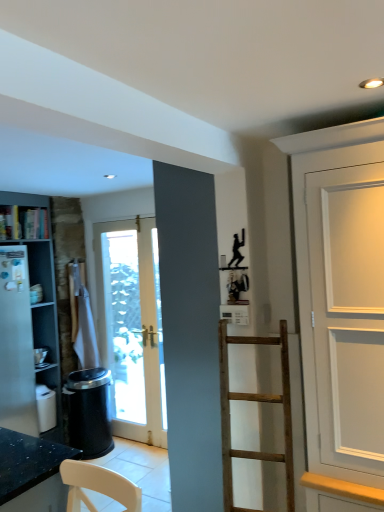
Image resolution: width=384 pixels, height=512 pixels. I want to click on wooden bookshelf at left, so click(x=27, y=215).

This screenshot has height=512, width=384. What do you see at coordinates (27, 215) in the screenshot?
I see `wooden bookshelf at left` at bounding box center [27, 215].

Based on the photo, what is the approximate width of wooden bookshelf at left?

8.91 inches.

This screenshot has height=512, width=384. What do you see at coordinates (41, 303) in the screenshot?
I see `white matte cabinet at left` at bounding box center [41, 303].

Where is `white matte cabinet at left`? white matte cabinet at left is located at coordinates (41, 303).

The image size is (384, 512). Find the location of `wooden bookshelf at left`. wooden bookshelf at left is located at coordinates (27, 215).

Does white matte cabinet at left appear on the right side of wooden bookshelf at left?

In fact, white matte cabinet at left is to the left of wooden bookshelf at left.

Does white matte cabinet at left come in front of wooden bookshelf at left?

Yes, white matte cabinet at left is closer to the camera.

Is point (56, 333) more distant than point (8, 232)?

Yes, point (56, 333) is behind point (8, 232).

From the image's perspective, between white matte cabinet at left and wooden bookshelf at left, who is located below?

From the image's view, white matte cabinet at left is below.

In the scene shown: From a real-world perspective, is white matte cabinet at left positioned above or below wooden bookshelf at left?

white matte cabinet at left is below wooden bookshelf at left.

Which of these two, white matte cabinet at left or wooden bookshelf at left, is wider?

With larger width is white matte cabinet at left.

Is white matte cabinet at left taller than wooden bookshelf at left?

Yes.

Can you confirm if white matte cabinet at left is smaller than wooden bookshelf at left?

No, white matte cabinet at left is not smaller than wooden bookshelf at left.

Which is correct: white matte cabinet at left is inside wooden bookshelf at left, or outside of it?

white matte cabinet at left is not inside wooden bookshelf at left, it's outside.

Is white matte cabinet at left touching wooden bookshelf at left?

No, white matte cabinet at left is not next to wooden bookshelf at left.

Is white matte cabinet at left facing towards wooden bookshelf at left?

Yes, white matte cabinet at left is turned towards wooden bookshelf at left.

What's the angular difference between white matte cabinet at left and wooden bookshelf at left's facing directions?

The facing directions of white matte cabinet at left and wooden bookshelf at left are 1.33 degrees apart.

Identify the location of cabinetry below the wooden bookshelf at left (from a real-world perspective). The image size is (384, 512). (41, 303).

Considering the positions of objects wooden bookshelf at left and white matte cabinet at left in the image provided, who is more to the left, wooden bookshelf at left or white matte cabinet at left?

white matte cabinet at left.

Is the position of wooden bookshelf at left more distant than that of white matte cabinet at left?

→ Yes, the depth of wooden bookshelf at left is greater than that of white matte cabinet at left.

Considering the positions of point (0, 211) and point (47, 381), is point (0, 211) closer or farther from the camera than point (47, 381)?

Point (0, 211).

From the image's perspective, is wooden bookshelf at left above white matte cabinet at left?

Indeed, from the image's perspective, wooden bookshelf at left is shown above white matte cabinet at left.

From a real-world perspective, between wooden bookshelf at left and white matte cabinet at left, who is vertically higher?

wooden bookshelf at left.

Considering the sizes of objects wooden bookshelf at left and white matte cabinet at left in the image provided, who is thinner, wooden bookshelf at left or white matte cabinet at left?

wooden bookshelf at left is thinner.

In the scene shown: Who is shorter, wooden bookshelf at left or white matte cabinet at left?

Standing shorter between the two is wooden bookshelf at left.

Consider the image. Is wooden bookshelf at left bigger than white matte cabinet at left?

No, wooden bookshelf at left is not bigger than white matte cabinet at left.

Is wooden bookshelf at left surrounding white matte cabinet at left?

Actually, white matte cabinet at left is outside wooden bookshelf at left.

Is wooden bookshelf at left touching white matte cabinet at left?

wooden bookshelf at left and white matte cabinet at left are clearly separated.

Is wooden bookshelf at left looking in the opposite direction of white matte cabinet at left?

Yes, wooden bookshelf at left is positioned with its back facing white matte cabinet at left.

Based on the photo, how many degrees apart are the facing directions of wooden bookshelf at left and white matte cabinet at left?

There is a 1.33-degree angle between the facing directions of wooden bookshelf at left and white matte cabinet at left.

How much distance is there between wooden bookshelf at left and white matte cabinet at left?

The distance of wooden bookshelf at left from white matte cabinet at left is 10.42 inches.

Image resolution: width=384 pixels, height=512 pixels. In the image, there is a wooden bookshelf at left. Find the location of `cabinetry below it (from the image's perspective)`. cabinetry below it (from the image's perspective) is located at coordinates (41, 303).

What are the coordinates of `cabinet above the white matte cabinet at left (from the image's perspective)` in the screenshot? It's located at (27, 215).

In order to click on cabinet behind the white matte cabinet at left in this screenshot , I will do `click(27, 215)`.